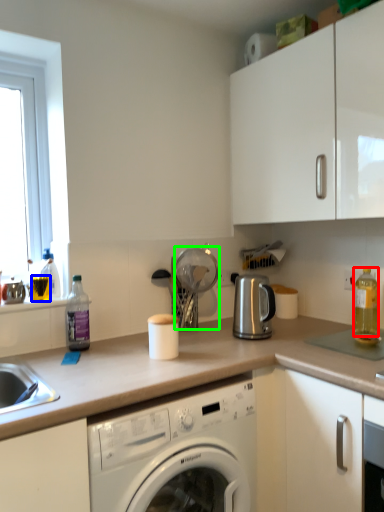
Question: Which object is the closest to the bottle (highlighted by a red box)? Choose among these: beverage (highlighted by a blue box) or appliance (highlighted by a green box).

Choices:
 (A) beverage
 (B) appliance

Answer: (B)